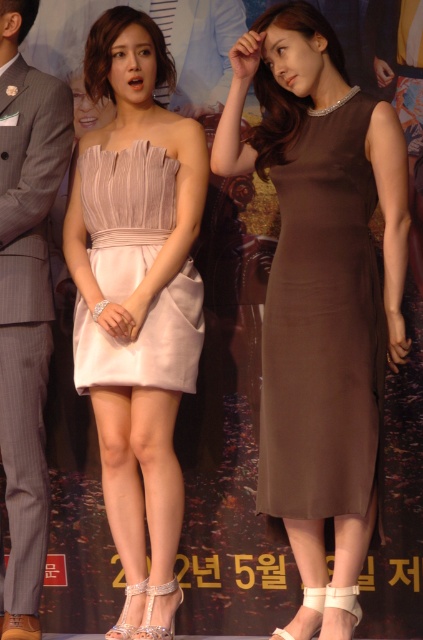
Question: Does gray pinstripe suit at left appear under pale pink satin dress at center?

Choices:
 (A) yes
 (B) no

Answer: (A)

Question: Which of these objects is positioned closest to the brown satin dress at center?

Choices:
 (A) matte pink dress at center
 (B) gray pinstripe suit at left
 (C) matte brown dress at center

Answer: (C)

Question: Where is matte pink dress at center located in relation to brown satin dress at center in the image?

Choices:
 (A) left
 (B) right

Answer: (A)

Question: Which point is closer to the camera?

Choices:
 (A) matte brown dress at center
 (B) gray pinstripe suit at left
 (C) brown satin dress at center

Answer: (A)

Question: Does matte brown dress at center appear under gray pinstripe suit at left?

Choices:
 (A) yes
 (B) no

Answer: (B)

Question: Estimate the real-world distances between objects in this image. Which object is farther from the matte brown dress at center?

Choices:
 (A) gray pinstripe suit at left
 (B) matte pink dress at center
 (C) brown satin dress at center

Answer: (A)